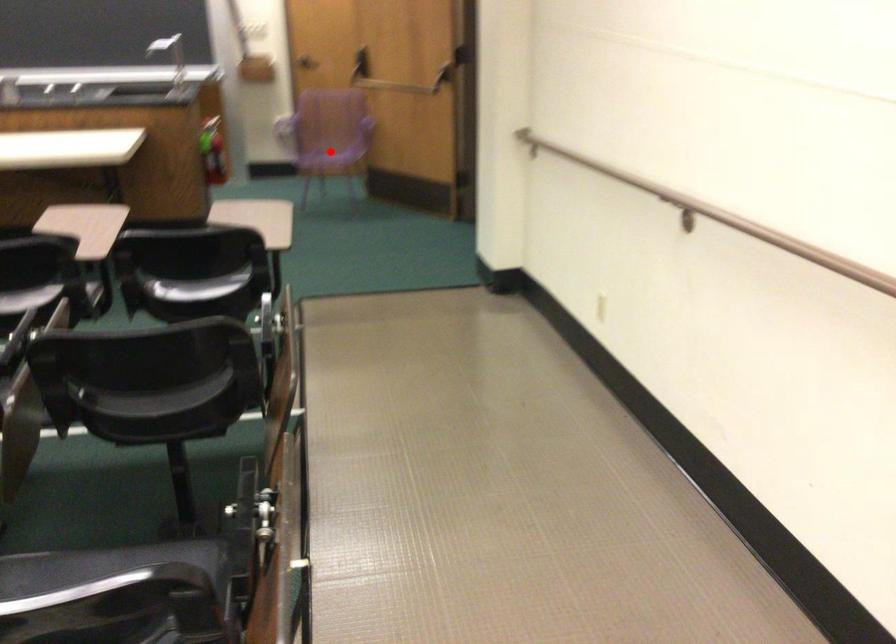
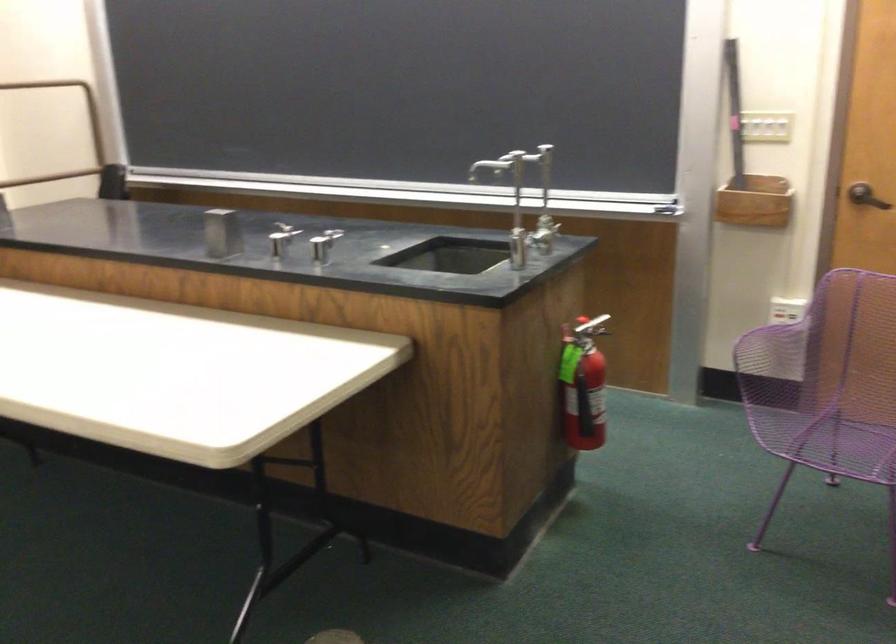
Question: I am providing you with two images of the same scene from different viewpoints. Given a red point in image1, look at the same physical point in image2. Is it:

Choices:
 (A) Closer to the viewpoint
 (B) Farther from the viewpoint

Answer: (A)